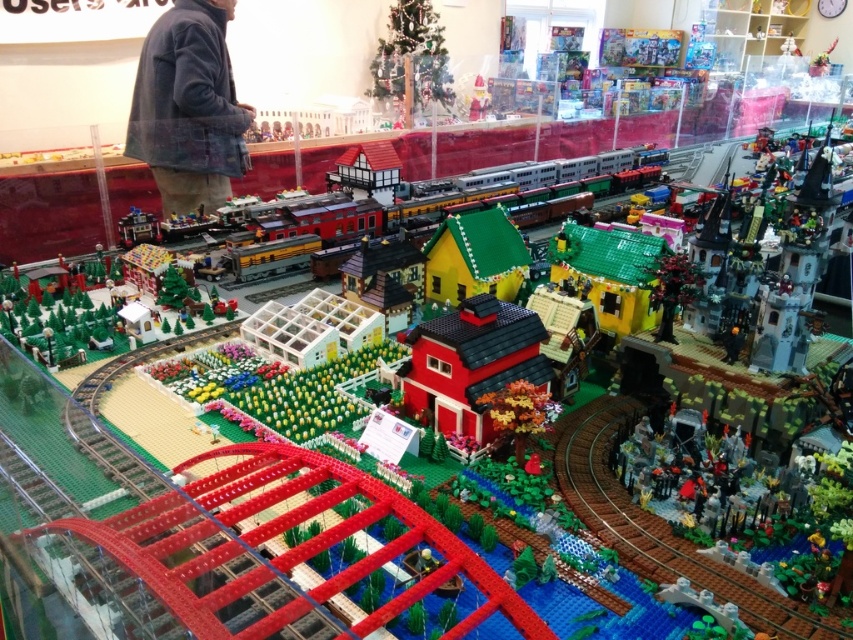
Does point (469, 189) lie in front of point (422, 400)?

No, it is behind (422, 400).

Can you confirm if brick train at center is thinner than brick red barn at center?

No, brick train at center is not thinner than brick red barn at center.

Who is more distant from viewer, (592, 179) or (490, 326)?

The point (592, 179) is behind.

Find the location of `brick train at center`. brick train at center is located at coordinates (x=515, y=196).

Between fuzzy blue jacket at upper left and brick red barn at center, which one has more height?

fuzzy blue jacket at upper left

Does fuzzy blue jacket at upper left lie in front of brick red barn at center?

No, it is behind brick red barn at center.

Is point (184, 196) positioned after point (419, 380)?

Yes, point (184, 196) is behind point (419, 380).

Locate an element on the screen. Image resolution: width=853 pixels, height=640 pixels. fuzzy blue jacket at upper left is located at coordinates (189, 108).

Where is `fuzzy blue jacket at upper left`? fuzzy blue jacket at upper left is located at coordinates (189, 108).

Between fuzzy blue jacket at upper left and brick train at center, which one is positioned lower?

brick train at center

Is point (178, 184) closer to camera compared to point (553, 218)?

Yes, point (178, 184) is closer to viewer.

At what (x,y) coordinates should I click in order to perform the action: click on fuzzy blue jacket at upper left. Please return your answer as a coordinate pair (x, y). This screenshot has width=853, height=640. Looking at the image, I should click on (189, 108).